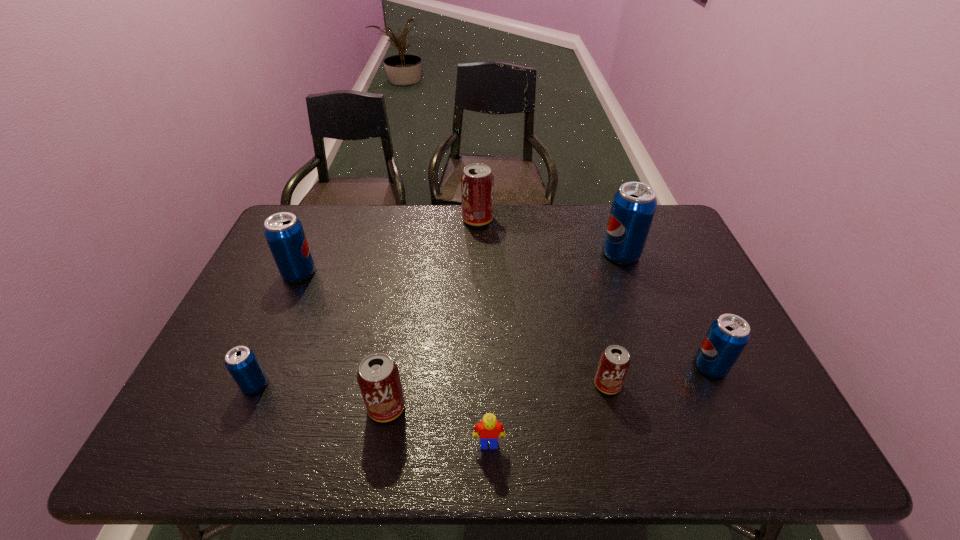
This screenshot has height=540, width=960. I want to click on the seventh closest object relative to the smallest blue pop soda, so click(x=728, y=335).

Where is `the third closest soda can to the rightmost object`? The image size is (960, 540). the third closest soda can to the rightmost object is located at coordinates (378, 376).

This screenshot has width=960, height=540. I want to click on soda can that is the closest to the farthest object, so click(634, 204).

Locate an element on the screen. The width and height of the screenshot is (960, 540). blue pop soda that is the fourth closest one to the sixth object from left to right is located at coordinates (284, 233).

The width and height of the screenshot is (960, 540). I want to click on blue pop soda that is the nearest to the smallest blue pop soda, so click(x=284, y=233).

Find the location of a particular element. This screenshot has height=540, width=960. red soda can identified as the closest to the Lego is located at coordinates (378, 376).

You are a GUI agent. You are given a task and a screenshot of the screen. Output one action in this format:
    pyautogui.click(x=<x>, y=<y>)
    Task: Click on the red soda can that is the second closest to the yellow Lego
    The image size is (960, 540).
    Given the screenshot: What is the action you would take?
    pyautogui.click(x=614, y=363)

Locate an element on the screen. Image resolution: width=960 pixels, height=540 pixels. vacant region that satisfies the following two spatial constraints: 1. on the back side of the smallest blue pop soda; 2. on the left side of the second smallest blue pop soda is located at coordinates (263, 366).

Locate an element on the screen. The height and width of the screenshot is (540, 960). vacant area in the image that satisfies the following two spatial constraints: 1. on the back side of the smallest blue pop soda; 2. on the right side of the third object from right to left is located at coordinates (255, 384).

Locate an element on the screen. The width and height of the screenshot is (960, 540). free space that satisfies the following two spatial constraints: 1. on the back side of the third soda can from left to right; 2. on the right side of the third soda can from right to left is located at coordinates coord(391,384).